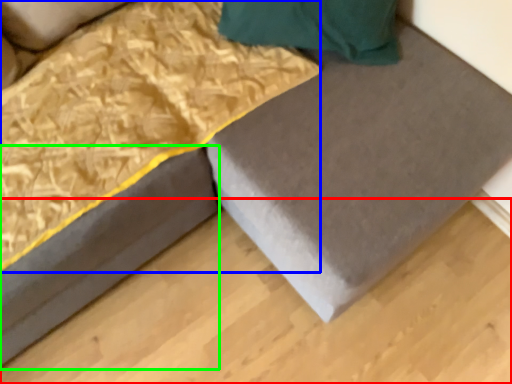
Question: Which is farther away from plywood (highlighted by a red box)? blanket (highlighted by a blue box) or bed frame (highlighted by a green box)?

Choices:
 (A) blanket
 (B) bed frame

Answer: (A)